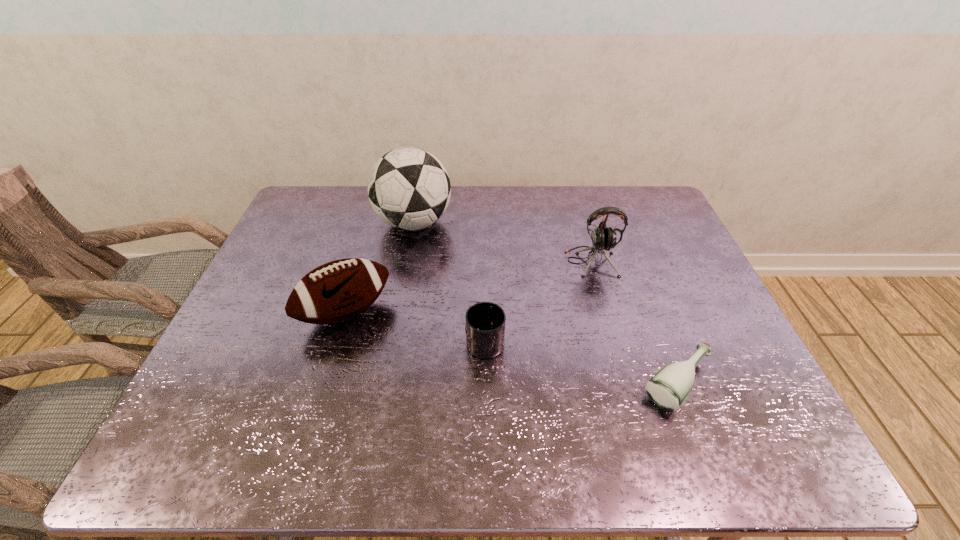
Where is `soccer ball`? This screenshot has width=960, height=540. soccer ball is located at coordinates (409, 188).

Where is `the second tallest object`? The height and width of the screenshot is (540, 960). the second tallest object is located at coordinates (603, 238).

At what (x,y) coordinates should I click in order to perform the action: click on football (American). Please return your answer as a coordinate pair (x, y). The height and width of the screenshot is (540, 960). Looking at the image, I should click on (337, 291).

You are a GUI agent. You are given a task and a screenshot of the screen. Output one action in this format:
    pyautogui.click(x=<x>, y=<y>)
    Task: Click on the fourth tallest object
    The width and height of the screenshot is (960, 540).
    Given the screenshot: What is the action you would take?
    pyautogui.click(x=485, y=321)

Where is `the third object from right to left`? The width and height of the screenshot is (960, 540). the third object from right to left is located at coordinates (485, 321).

The height and width of the screenshot is (540, 960). Find the location of `bottle`. bottle is located at coordinates (668, 389).

This screenshot has height=540, width=960. Find the location of `blank space located 0.070m on the surface of the tallest object where the brand logo is visible`. blank space located 0.070m on the surface of the tallest object where the brand logo is visible is located at coordinates coord(473,223).

You are a GUI agent. You are given a task and a screenshot of the screen. Output one action in this format:
    pyautogui.click(x=<x>, y=<y>)
    Task: Click on the free region located on the front of the earphone
    The height and width of the screenshot is (540, 960).
    Given the screenshot: What is the action you would take?
    pyautogui.click(x=611, y=332)

The height and width of the screenshot is (540, 960). In order to click on vacant space located 0.180m on the back of the football (American) in this screenshot , I will do `click(366, 247)`.

This screenshot has height=540, width=960. I want to click on free region located with the handle on the side of the third object from left to right, so click(x=484, y=235).